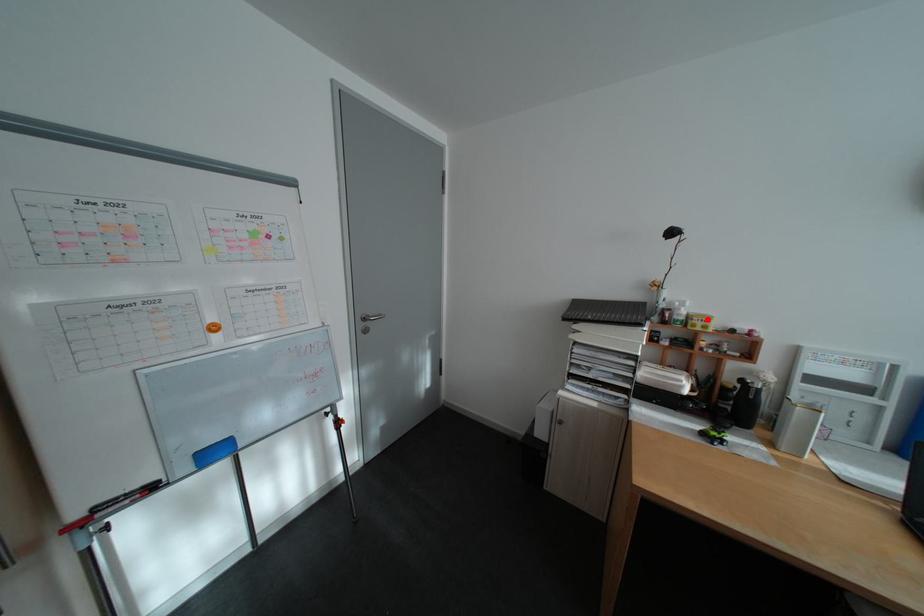
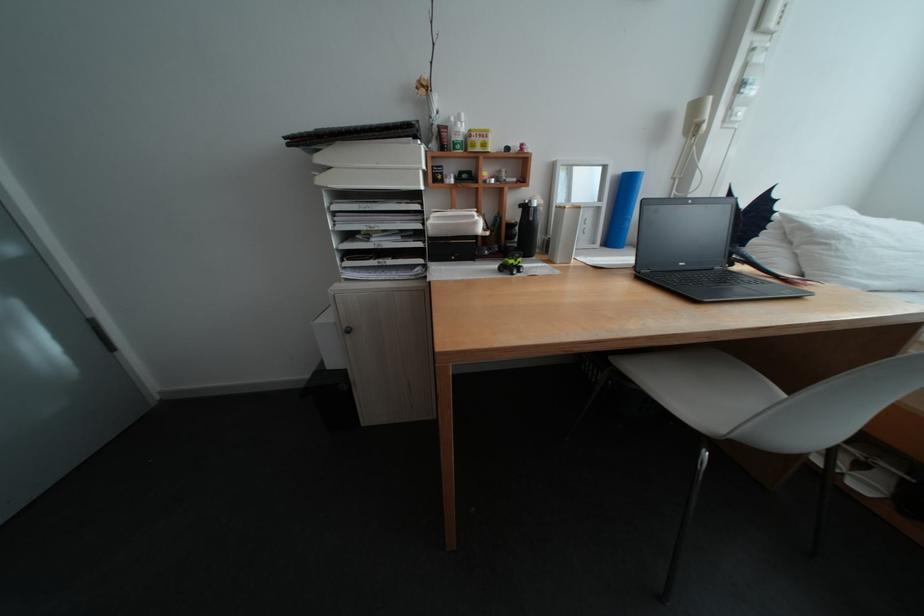
Where in the second image is the point corresponding to the highlighted location from the first image?

(485, 135)